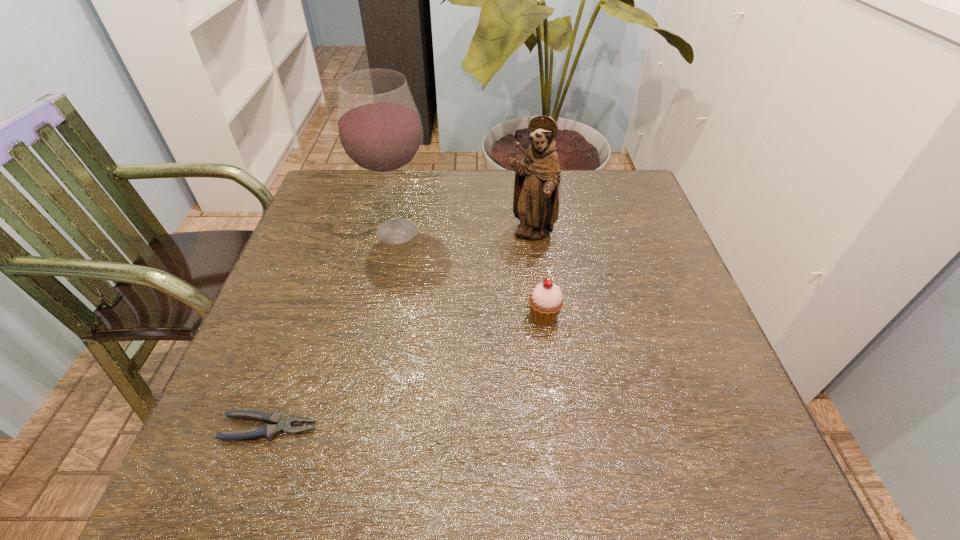
Where is `alcohol at the far edge`? Image resolution: width=960 pixels, height=540 pixels. alcohol at the far edge is located at coordinates (379, 129).

The width and height of the screenshot is (960, 540). I want to click on figurine at the far edge, so click(537, 177).

At what (x,y) coordinates should I click in order to perform the action: click on object situated at the near edge. Please return your answer as a coordinate pair (x, y). Looking at the image, I should click on (284, 424).

Find the location of a particular element. Image resolution: width=960 pixels, height=540 pixels. alcohol situated at the left edge is located at coordinates (379, 129).

Find the location of a particular element. The image size is (960, 540). pliers that is at the left edge is located at coordinates (284, 424).

At what (x,y) coordinates should I click in order to perform the action: click on object located at the far left corner. Please return your answer as a coordinate pair (x, y). Looking at the image, I should click on (379, 129).

At what (x,y) coordinates should I click in order to perform the action: click on object located in the near left corner section of the desktop. Please return your answer as a coordinate pair (x, y). The height and width of the screenshot is (540, 960). Looking at the image, I should click on (284, 424).

This screenshot has height=540, width=960. I want to click on vacant space at the far edge of the desktop, so click(x=418, y=192).

This screenshot has height=540, width=960. I want to click on blank space at the left edge of the desktop, so click(x=297, y=425).

At what (x,y) coordinates should I click in order to perform the action: click on vacant area at the right edge. Please return your answer as a coordinate pair (x, y). The height and width of the screenshot is (540, 960). Looking at the image, I should click on [x=616, y=285].